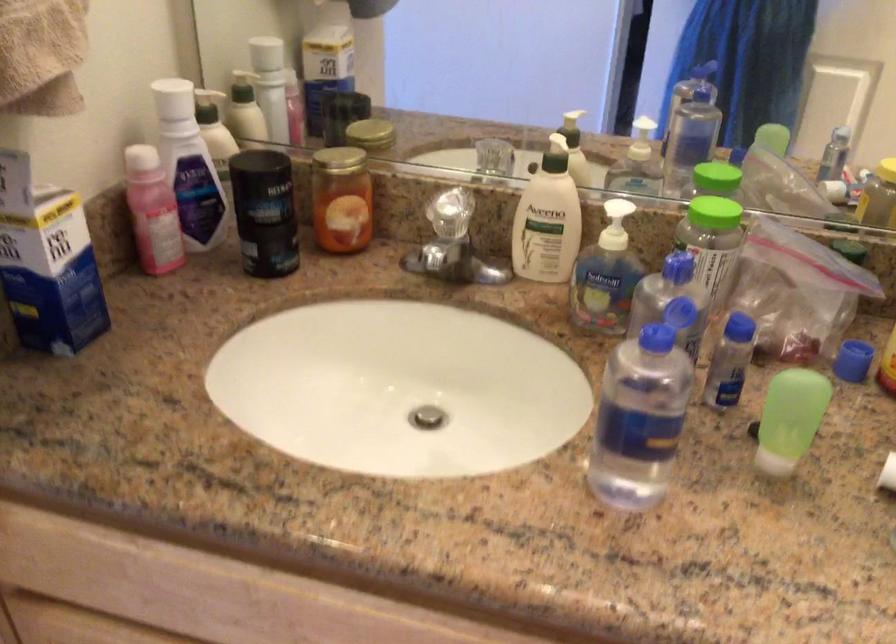
In order to click on green squeeze tube in this screenshot , I will do `click(789, 419)`.